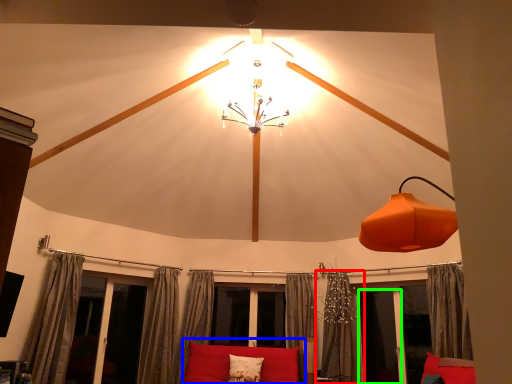
Question: Which object is positioned closest to curtain (highlighted by a red box)? Select from couch (highlighted by a blue box) and screen door (highlighted by a green box).

Choices:
 (A) couch
 (B) screen door

Answer: (B)